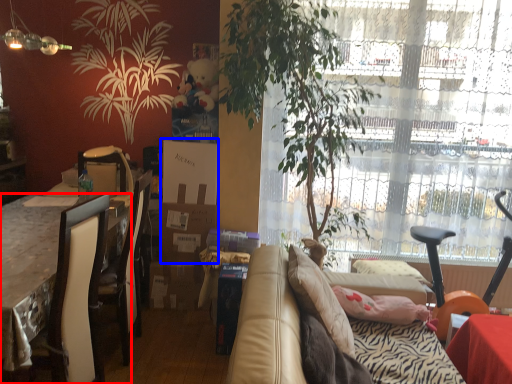
Question: Which point is further to the camera, desk (highlighted by a red box) or box (highlighted by a blue box)?

Choices:
 (A) desk
 (B) box

Answer: (B)